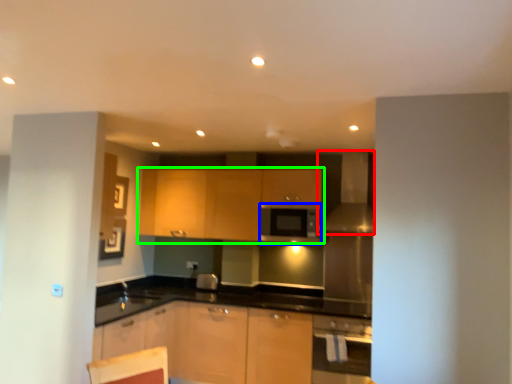
Question: Considering the real-world distances, which object is farthest from exhaust hood (highlighted by a red box)? appliance (highlighted by a blue box) or cabinetry (highlighted by a green box)?

Choices:
 (A) appliance
 (B) cabinetry

Answer: (B)